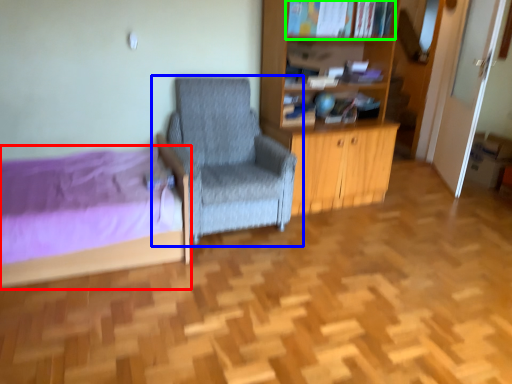
Question: Based on their relative distances, which object is nearer to bed (highlighted by a red box)? Choose from chair (highlighted by a blue box) and book (highlighted by a green box).

Choices:
 (A) chair
 (B) book

Answer: (A)